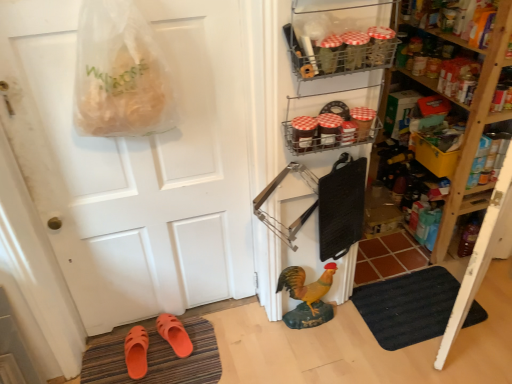
Identify the location of free space in front of black rubber doormat at lower right, placed as the 2th doormat when sorted from left to right. (434, 360).